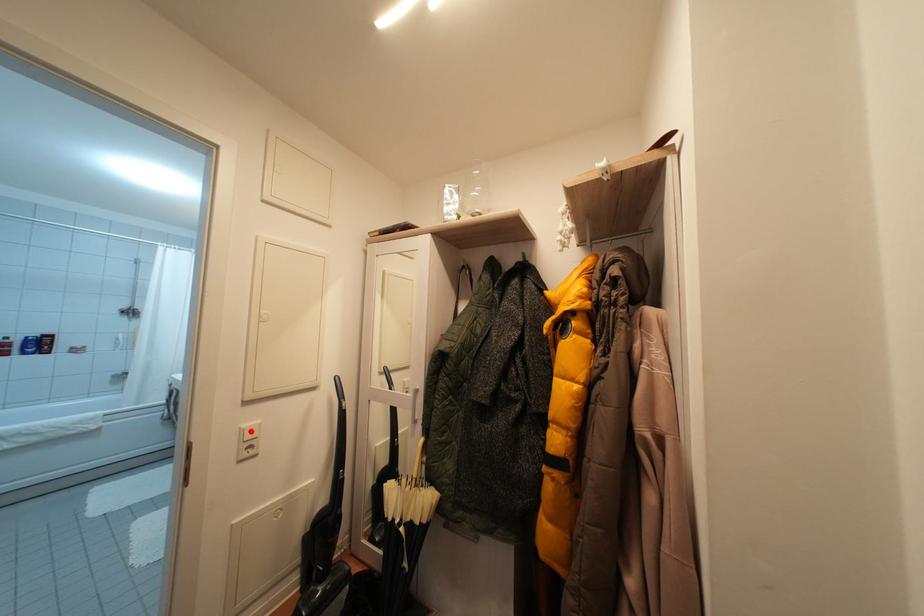
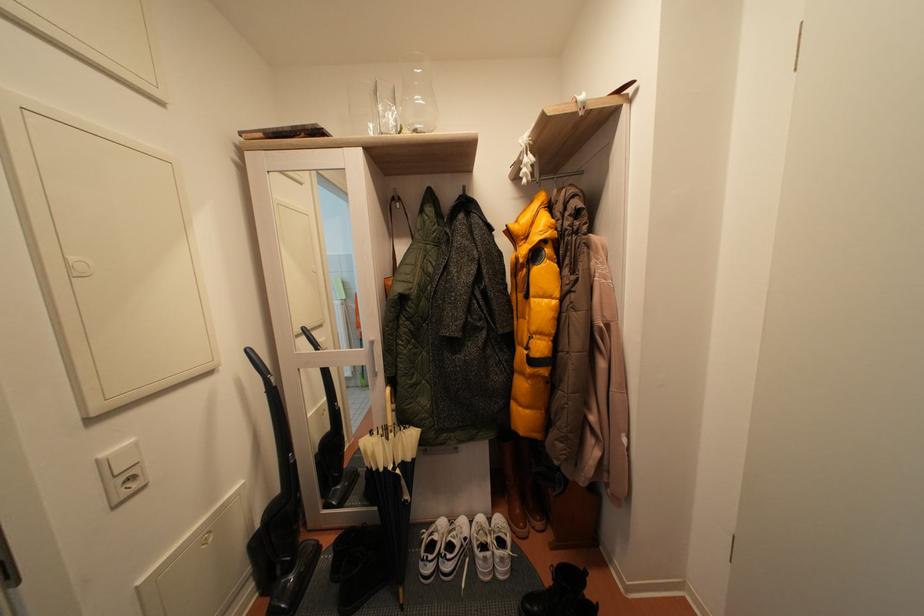
Locate, in the second image, the point that corresponds to the highlighted location in the first image.

(111, 460)